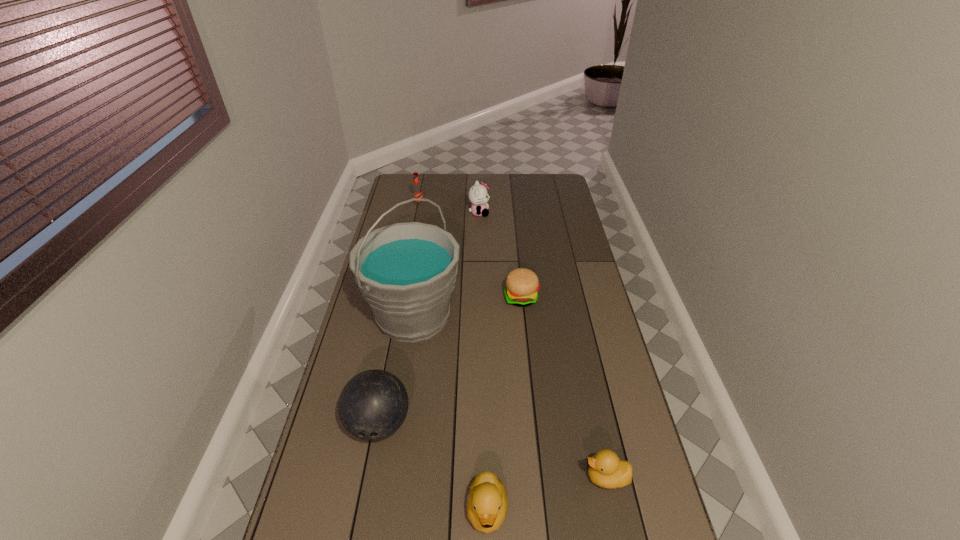
At what (x,y) coordinates should I click in order to perform the action: click on free location located on the front of the root beer. Please return your answer as a coordinate pair (x, y). This screenshot has height=540, width=960. Looking at the image, I should click on (410, 249).

This screenshot has width=960, height=540. In order to click on vacant point located 0.150m on the front-facing side of the kitten in this screenshot , I will do click(x=520, y=213).

Where is `free spot located 0.080m on the right of the tallest object`? The height and width of the screenshot is (540, 960). free spot located 0.080m on the right of the tallest object is located at coordinates 484,316.

Locate an element on the screen. The image size is (960, 540). free space located on the grip area of the fifth farthest object is located at coordinates (358, 534).

Identify the location of vacant space situated 0.230m on the back of the hamburger. The height and width of the screenshot is (540, 960). (516, 251).

Find the location of a particular element. This screenshot has height=540, width=960. root beer at the left edge is located at coordinates (417, 192).

Identify the location of bucket situated at the left edge. (406, 272).

The image size is (960, 540). I want to click on bowling ball at the left edge, so click(373, 405).

This screenshot has width=960, height=540. I want to click on object present at the right edge, so click(606, 470).

In the image, there is a desktop. In order to click on vacant space at the far edge in this screenshot , I will do `click(450, 193)`.